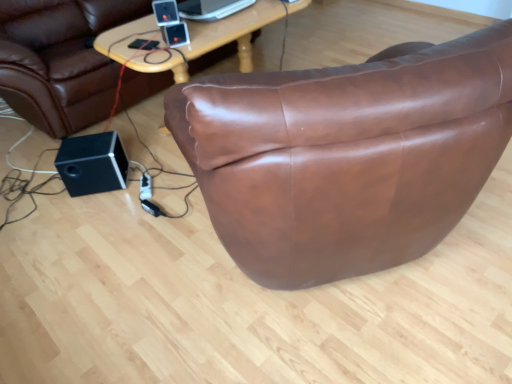
Question: Is brown leather bean bag chair at center thinner than black plastic speaker at upper center, which appears as the first speaker when viewed from the right?

Choices:
 (A) no
 (B) yes

Answer: (A)

Question: From the image's perspective, is brown leather bean bag chair at center under black plastic speaker at upper center, the 1th speaker when ordered from top to bottom?

Choices:
 (A) no
 (B) yes

Answer: (A)

Question: From a real-world perspective, is brown leather bean bag chair at center below black plastic speaker at upper center, the first speaker viewed from the front?

Choices:
 (A) yes
 (B) no

Answer: (A)

Question: Does brown leather bean bag chair at center touch black plastic speaker at upper center, the second speaker viewed from the left?

Choices:
 (A) yes
 (B) no

Answer: (B)

Question: Does brown leather bean bag chair at center contain black plastic speaker at upper center, which is counted as the second speaker, starting from the back?

Choices:
 (A) no
 (B) yes

Answer: (A)

Question: Considering the positions of brown leather bean bag chair at center and satin black ipod at upper center in the image, is brown leather bean bag chair at center bigger or smaller than satin black ipod at upper center?

Choices:
 (A) big
 (B) small

Answer: (A)

Question: From a real-world perspective, is brown leather bean bag chair at center physically located above or below satin black ipod at upper center?

Choices:
 (A) below
 (B) above

Answer: (A)

Question: Based on their positions, is brown leather bean bag chair at center located to the left or right of satin black ipod at upper center?

Choices:
 (A) left
 (B) right

Answer: (A)

Question: Looking at their shapes, would you say brown leather bean bag chair at center is wider or thinner than satin black ipod at upper center?

Choices:
 (A) thin
 (B) wide

Answer: (B)

Question: From the image's perspective, is black plastic speaker at upper center, the first speaker viewed from the front, positioned above or below black matte speaker at lower left, placed as the 1th speaker when sorted from left to right?

Choices:
 (A) below
 (B) above

Answer: (B)

Question: Considering the positions of black plastic speaker at upper center, which appears as the first speaker when viewed from the right, and black matte speaker at lower left, which is the second speaker in front-to-back order, in the image, is black plastic speaker at upper center, which appears as the first speaker when viewed from the right, taller or shorter than black matte speaker at lower left, which is the second speaker in front-to-back order,?

Choices:
 (A) short
 (B) tall

Answer: (A)

Question: In terms of width, does black plastic speaker at upper center, which is counted as the second speaker, starting from the back, look wider or thinner when compared to black matte speaker at lower left, placed as the 1th speaker when sorted from left to right?

Choices:
 (A) wide
 (B) thin

Answer: (B)

Question: Is point (159, 6) positioned closer to the camera than point (66, 163)?

Choices:
 (A) farther
 (B) closer

Answer: (B)

Question: Is point (117, 182) positioned closer to the camera than point (167, 26)?

Choices:
 (A) closer
 (B) farther

Answer: (B)

Question: Would you say black matte speaker at lower left, which is the 2th speaker in top-to-bottom order, is to the left or to the right of satin black ipod at upper center in the picture?

Choices:
 (A) right
 (B) left

Answer: (B)